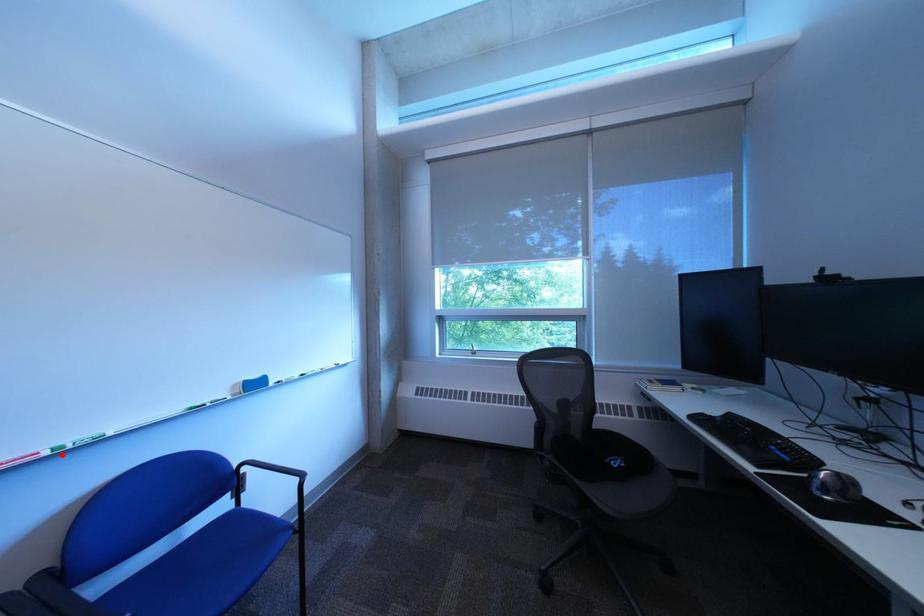
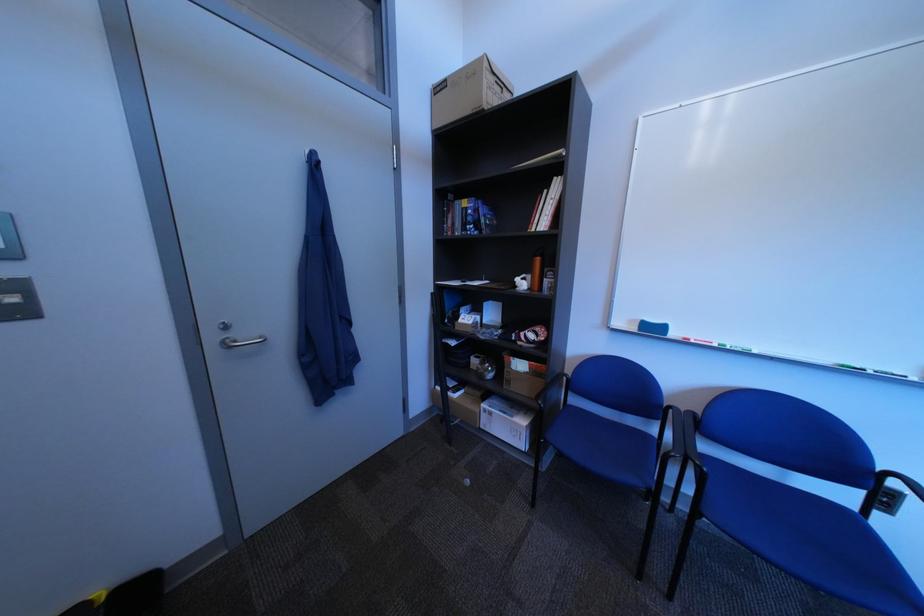
The point at the highlighted location is marked in the first image. Where is the corresponding point in the second image?

(732, 347)